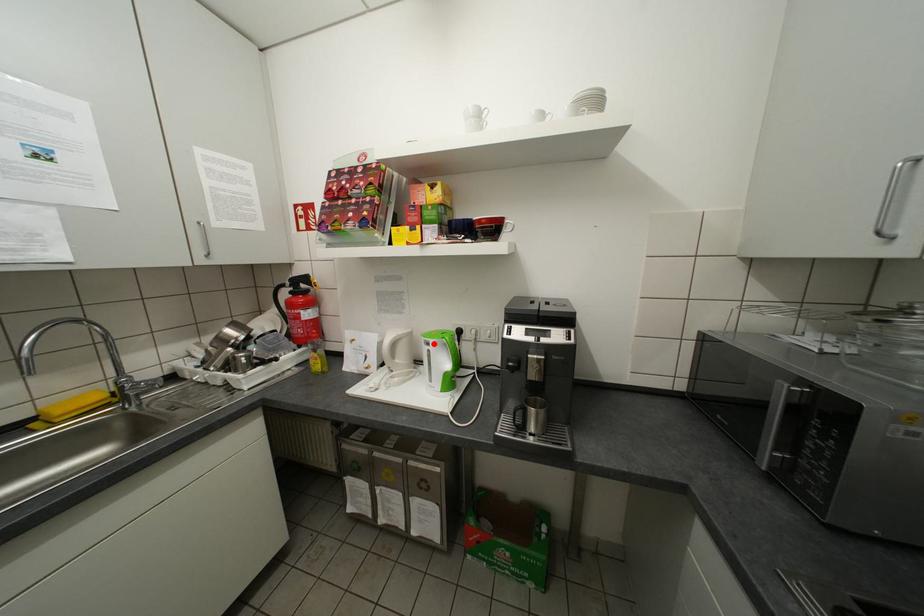
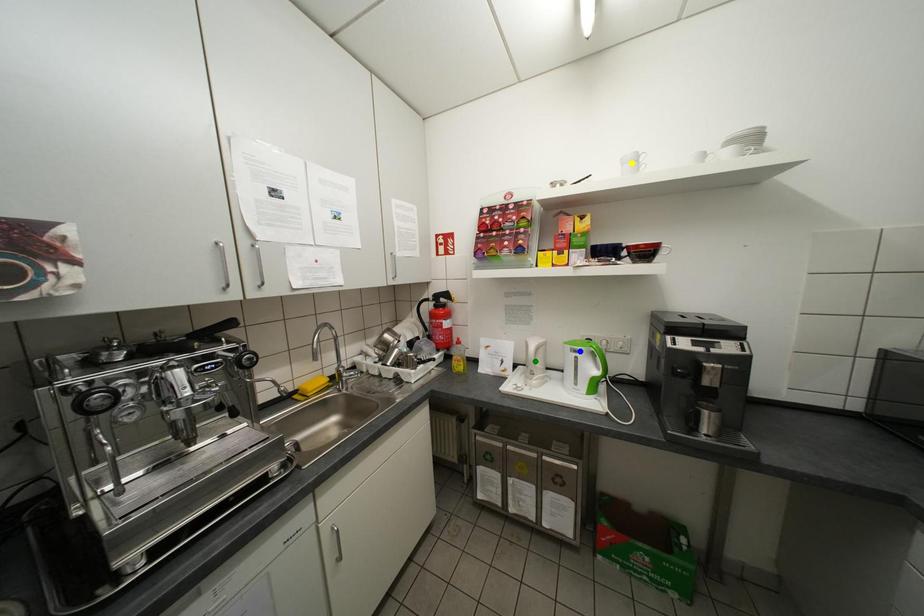
Question: I am providing you with two images of the same scene from different viewpoints. A red point is marked on the first image. You are given multiple points on the second image. Can you choose the point in image 2 that corresponds to the point in image 1?

Choices:
 (A) blue point
 (B) yellow point
 (C) green point

Answer: (A)